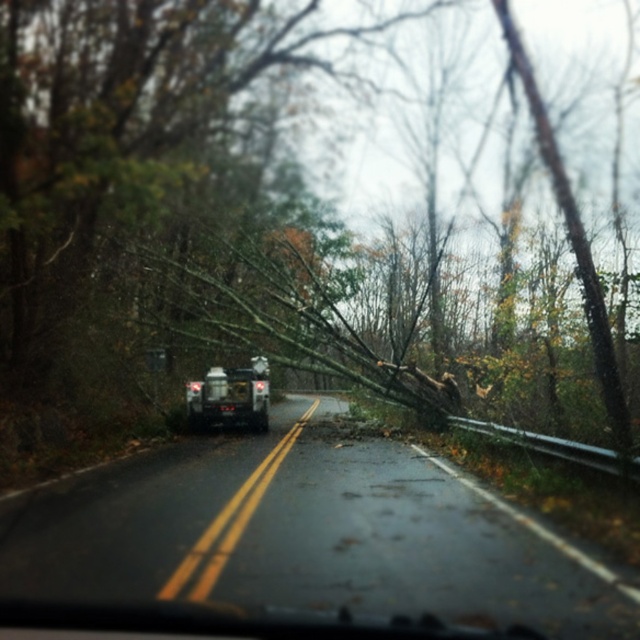
Question: Does brown wood tree at center have a larger size compared to black asphalt road at center?

Choices:
 (A) yes
 (B) no

Answer: (A)

Question: Is black asphalt road at center further to camera compared to metallic silver suv at center?

Choices:
 (A) no
 (B) yes

Answer: (A)

Question: Among these points, which one is nearest to the camera?

Choices:
 (A) (56, 164)
 (B) (365, 452)

Answer: (A)

Question: Among these objects, which one is nearest to the camera?

Choices:
 (A) black asphalt road at center
 (B) metallic silver suv at center

Answer: (A)

Question: Which point is farther to the camera?

Choices:
 (A) (225, 512)
 (B) (173, 236)
 (C) (209, 388)

Answer: (B)

Question: Observing the image, what is the correct spatial positioning of brown wood tree at center in reference to metallic silver suv at center?

Choices:
 (A) left
 (B) right

Answer: (B)